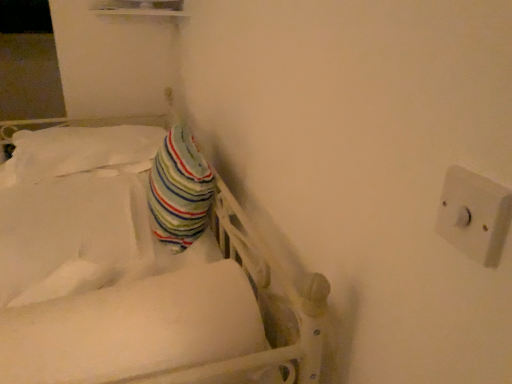
Question: Is white plastic switch at upper right completely or partially inside striped fabric pillow at upper left?

Choices:
 (A) yes
 (B) no

Answer: (B)

Question: From the image's perspective, would you say striped fabric pillow at upper left is shown under white plastic switch at upper right?

Choices:
 (A) yes
 (B) no

Answer: (B)

Question: Is striped fabric pillow at upper left smaller than white plastic switch at upper right?

Choices:
 (A) yes
 (B) no

Answer: (B)

Question: Is white plastic switch at upper right at the back of striped fabric pillow at upper left?

Choices:
 (A) yes
 (B) no

Answer: (B)

Question: Does striped fabric pillow at upper left lie in front of white plastic switch at upper right?

Choices:
 (A) no
 (B) yes

Answer: (A)

Question: Is the position of striped fabric pillow at upper left more distant than that of white plastic switch at upper right?

Choices:
 (A) no
 (B) yes

Answer: (B)

Question: Considering the relative sizes of white plastic switch at upper right and striped fabric pillow at center in the image provided, is white plastic switch at upper right smaller than striped fabric pillow at center?

Choices:
 (A) yes
 (B) no

Answer: (A)

Question: Is the depth of white plastic switch at upper right less than that of striped fabric pillow at center?

Choices:
 (A) no
 (B) yes

Answer: (B)

Question: From the image's perspective, does white plastic switch at upper right appear higher than striped fabric pillow at center?

Choices:
 (A) no
 (B) yes

Answer: (A)

Question: Does white plastic switch at upper right have a greater width compared to striped fabric pillow at center?

Choices:
 (A) yes
 (B) no

Answer: (B)

Question: Is white plastic switch at upper right positioned beyond the bounds of striped fabric pillow at center?

Choices:
 (A) no
 (B) yes

Answer: (B)

Question: Does white plastic switch at upper right turn towards striped fabric pillow at center?

Choices:
 (A) yes
 (B) no

Answer: (B)

Question: From the image's perspective, is striped fabric pillow at upper left over white soft mattress at center?

Choices:
 (A) yes
 (B) no

Answer: (A)